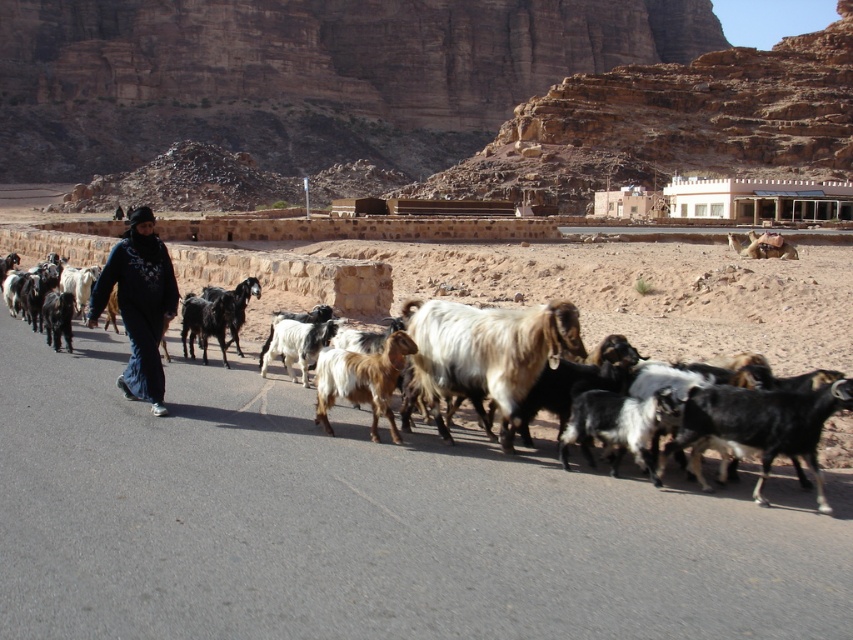
Question: Which of the following is the farthest from the observer?

Choices:
 (A) (613, 262)
 (B) (735, 444)

Answer: (A)

Question: Observing the image, what is the correct spatial positioning of black woolen goat at center in reference to brown woolen goat at center?

Choices:
 (A) above
 (B) below

Answer: (B)

Question: Considering the real-world distances, which object is closest to the black fabric at center?

Choices:
 (A) shaggy brown goat at center
 (B) brown woolen goat at center

Answer: (B)

Question: Does fluffy brown sheep at center come in front of shaggy brown goat at center?

Choices:
 (A) yes
 (B) no

Answer: (A)

Question: From the image, what is the correct spatial relationship of black woolen goat at center in relation to brown woolen goat at center?

Choices:
 (A) below
 (B) above

Answer: (A)

Question: Which object appears farthest from the camera in this image?

Choices:
 (A) black fabric at center
 (B) white woolen goat at center
 (C) black woolen goat at center

Answer: (A)